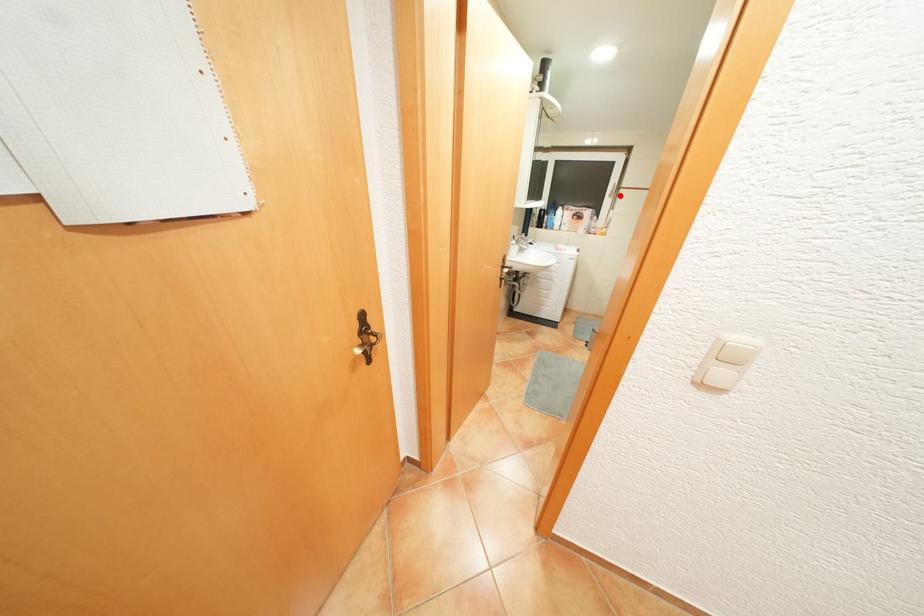
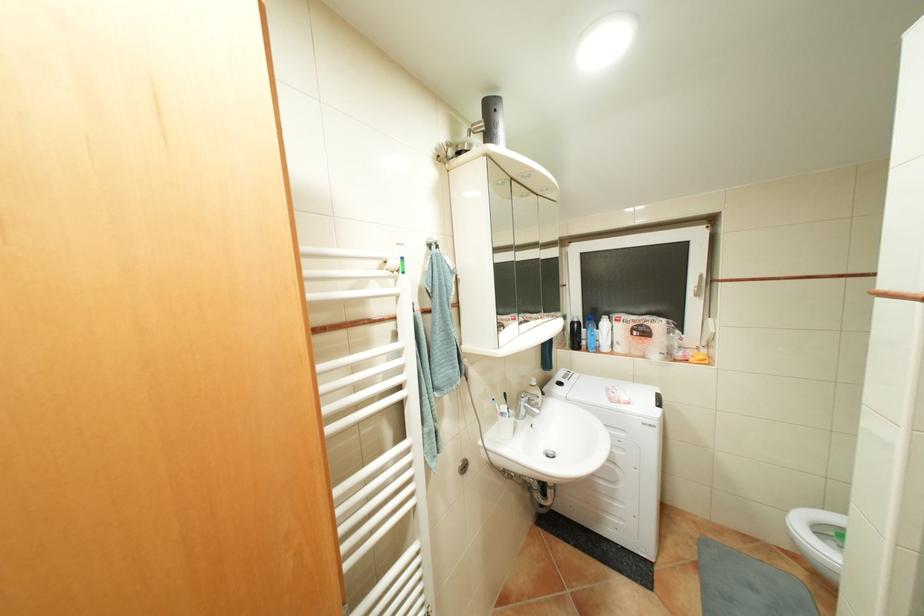
Question: I am providing you with two images of the same scene from different viewpoints. Image1 has a red point marked. In image2, the corresponding 3D location appears at what relative position? Reply with the corresponding letter.

Choices:
 (A) Closer
 (B) Farther

Answer: (B)